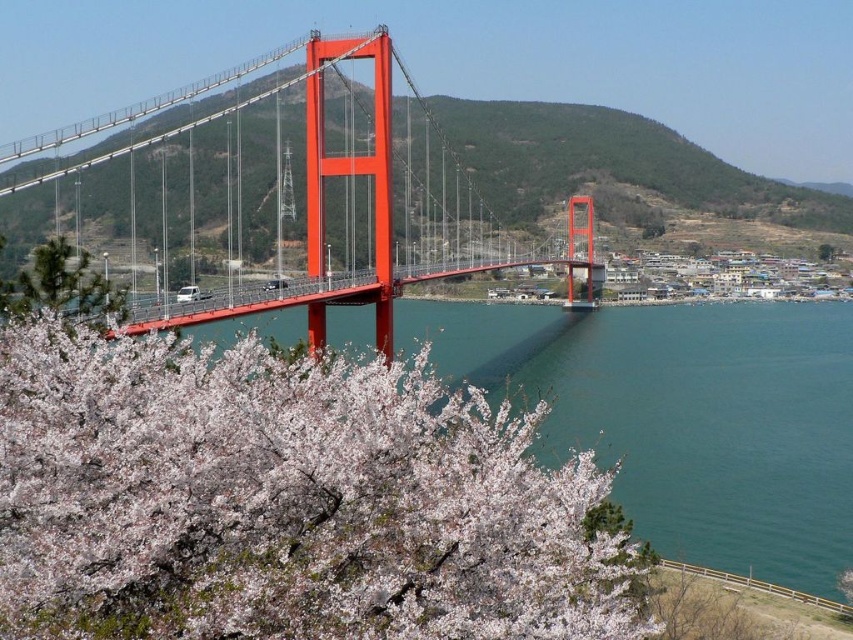
You are a photographer planning to capture the bright orange bridge at center and the clear blue water at lower center in a single shot. Based on their positions, which object should you position first in your camera frame to ensure both are included?

The clear blue water at lower center is to the right of the bright orange bridge at center, so you should position the bright orange bridge at center first in the left side of your frame to ensure the clear blue water at lower center fits to its right.

You are standing on the red suspension bridge and want to take a photo. There are two points marked on the bridge, point (521,365) and point (387,177). Which point is closer to you when you look through the camera lens?

Point (387,177) is closer to you because it is less further to the camera than point (521,365) according to the description.